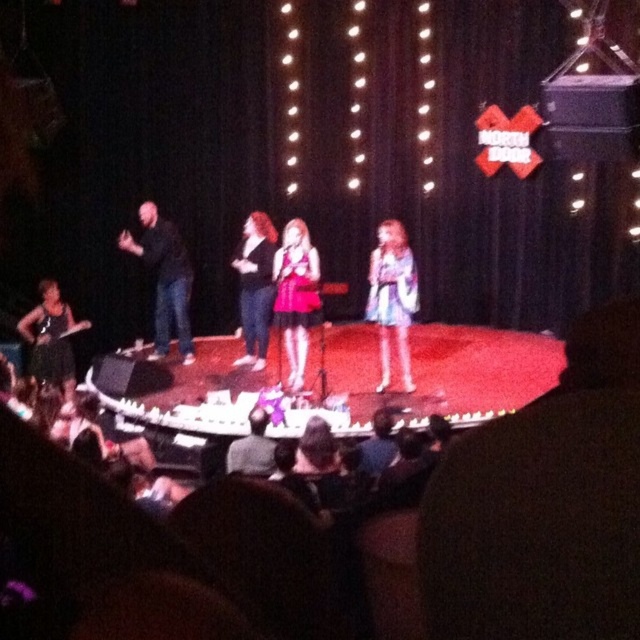
Question: Is matte blue dress at center to the right of black matte shirt at left from the viewer's perspective?

Choices:
 (A) no
 (B) yes

Answer: (B)

Question: Which point is closer to the camera?

Choices:
 (A) (296, 381)
 (B) (396, 284)

Answer: (B)

Question: Which point is farther to the camera?

Choices:
 (A) matte blue dress at center
 (B) black matte shirt at left
 (C) matte black dress at center
 (D) matte pink dress at center

Answer: (B)

Question: Can you confirm if matte blue dress at center is positioned above matte pink dress at center?

Choices:
 (A) yes
 (B) no

Answer: (B)

Question: Among these points, which one is farthest from the camera?

Choices:
 (A) (256, 246)
 (B) (289, 314)
 (C) (237, 445)
 (D) (124, 243)

Answer: (D)

Question: Does black matte shirt at left appear over dark gray fabric hat at lower center?

Choices:
 (A) yes
 (B) no

Answer: (A)